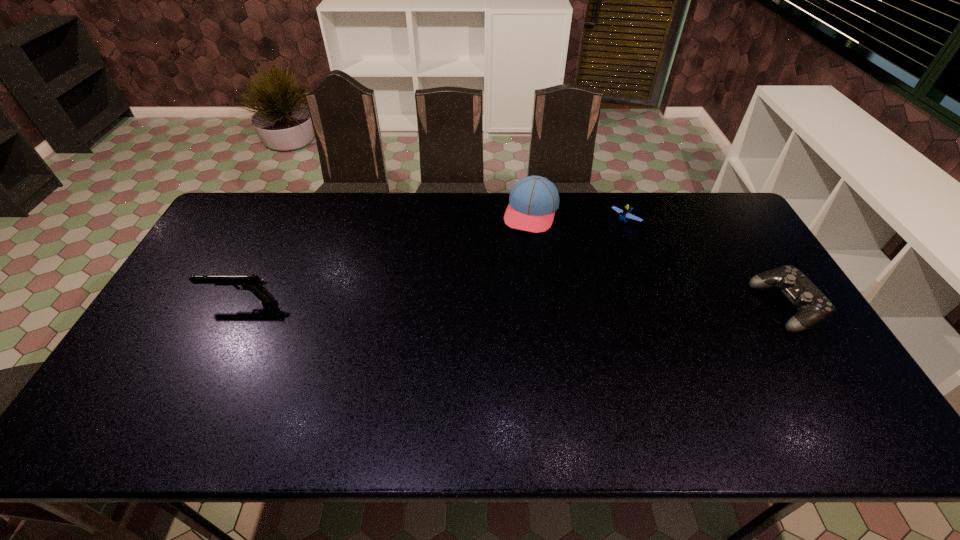
At what (x,y) coordinates should I click in order to perform the action: click on gun. Please return your answer as a coordinate pair (x, y). Looking at the image, I should click on (253, 283).

Find the location of a particular element. the rightmost object is located at coordinates (813, 306).

Identify the location of the third tallest object. (813, 306).

Find the location of `baseball cap`. baseball cap is located at coordinates (533, 200).

I want to click on Lego, so click(x=624, y=214).

The width and height of the screenshot is (960, 540). Identify the location of the second object from right to left. (624, 214).

This screenshot has height=540, width=960. I want to click on vacant space positioned 0.100m at the aiming end of the leftmost object, so click(171, 301).

Find the location of `vacant space located 0.120m on the back of the rightmost object`. vacant space located 0.120m on the back of the rightmost object is located at coordinates (753, 254).

Where is `vacant space located on the front-facing side of the baseball cap`? The image size is (960, 540). vacant space located on the front-facing side of the baseball cap is located at coordinates (504, 289).

This screenshot has height=540, width=960. Find the location of `free location located 0.140m on the front-facing side of the baseball cap`. free location located 0.140m on the front-facing side of the baseball cap is located at coordinates coord(515,262).